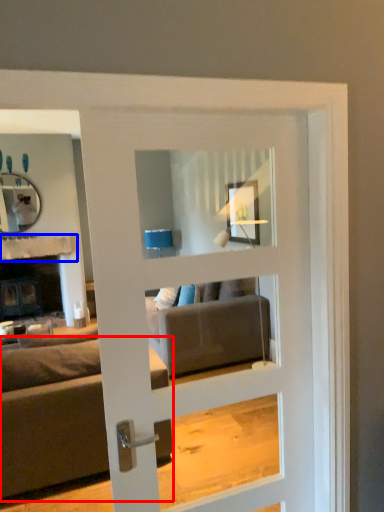
Question: Which of the following is the closest to the observer, studio couch (highlighted by a red box) or balustrade (highlighted by a blue box)?

Choices:
 (A) studio couch
 (B) balustrade

Answer: (A)